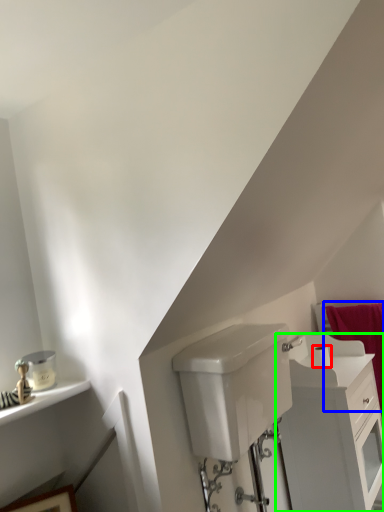
Question: Which object is positioned farthest from toilet paper (highlighted by a red box)? Select from bath towel (highlighted by a blue box) and bathroom cabinet (highlighted by a green box).

Choices:
 (A) bath towel
 (B) bathroom cabinet

Answer: (A)